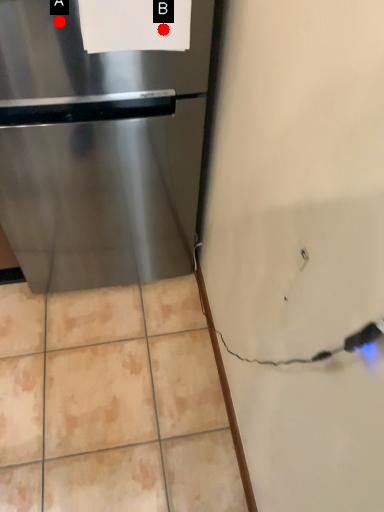
Question: Two points are circled on the image, labeled by A and B beside each circle. Which point is farther from the camera taking this photo?

Choices:
 (A) A is further
 (B) B is further

Answer: (B)